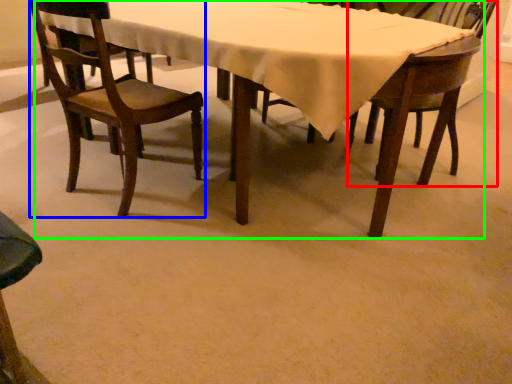
Question: Considering the real-world distances, which object is closest to chair (highlighted by a red box)? chair (highlighted by a blue box) or kitchen & dining room table (highlighted by a green box).

Choices:
 (A) chair
 (B) kitchen & dining room table

Answer: (B)